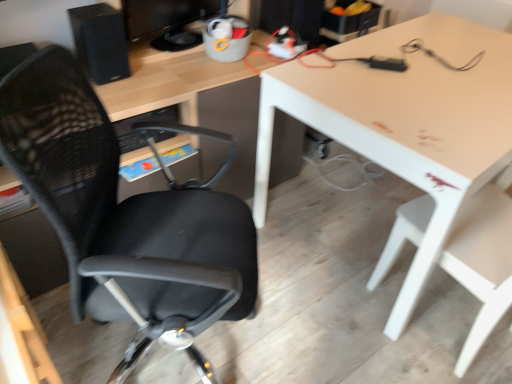
Where is `free space to the left of white plastic chair at lower right, which appears as the 1th chair when viewed from the right`? The height and width of the screenshot is (384, 512). free space to the left of white plastic chair at lower right, which appears as the 1th chair when viewed from the right is located at coordinates (330, 328).